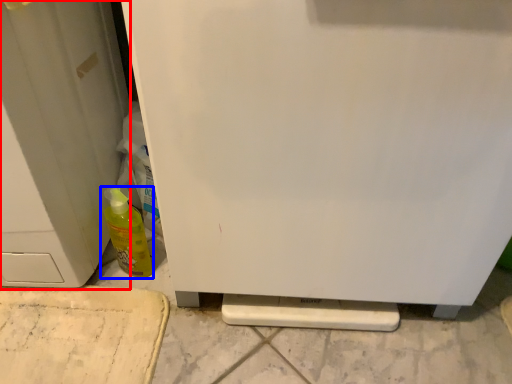
Question: Which object is closer to the camera taking this photo, door (highlighted by a red box) or bottle (highlighted by a blue box)?

Choices:
 (A) door
 (B) bottle

Answer: (A)